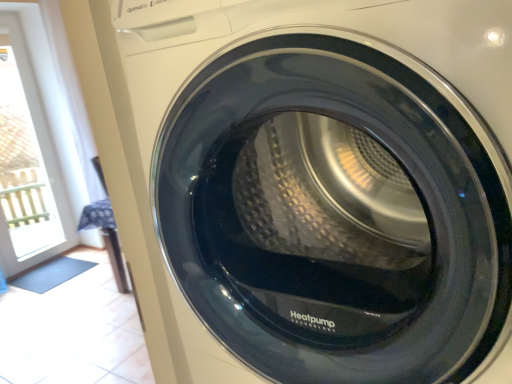
This screenshot has width=512, height=384. Find the location of `white glass window at upper left`. white glass window at upper left is located at coordinates (25, 167).

Image resolution: width=512 pixels, height=384 pixels. Describe the element at coordinates (25, 167) in the screenshot. I see `white glass window at upper left` at that location.

Identify the location of white glass window at upper left. The width and height of the screenshot is (512, 384). (25, 167).